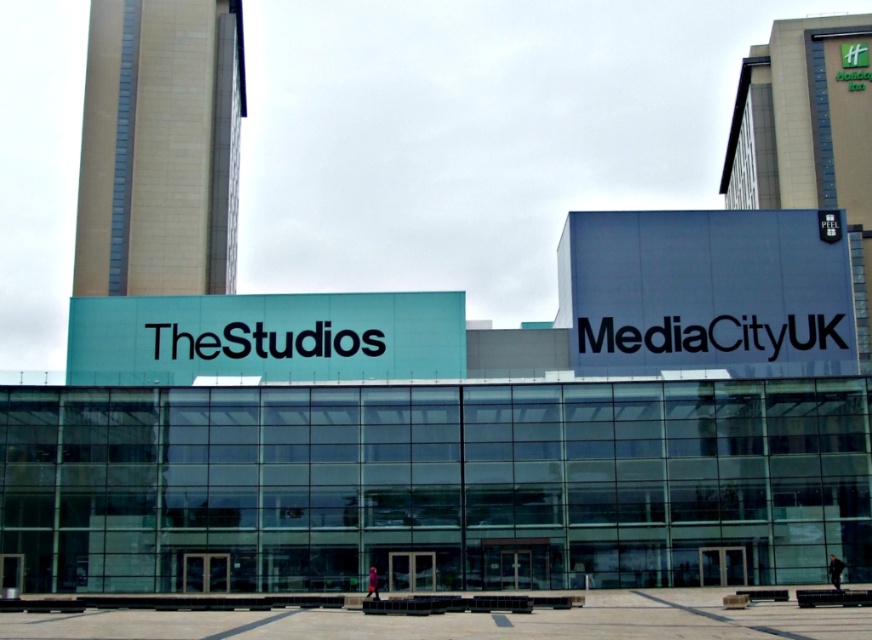
Looking at this image, you are a photographer positioned at the base of the building complex. You want to capture both the beige brick tower at upper left and the green glass tower at upper right in a single shot. Which tower should you aim your camera upwards to include in the frame?

To include both the beige brick tower at upper left and the green glass tower at upper right in a single shot, you should aim your camera upwards because the beige brick tower at upper left is located below the green glass tower at upper right.

You are standing in front of the modern building complex and want to take a photo of both the beige brick tower at upper left and the green glass tower at upper right. However, you notice that one of them is partially hidden. Which tower is obstructed and why?

The green glass tower at upper right is obstructed because it is positioned behind the beige brick tower at upper left.